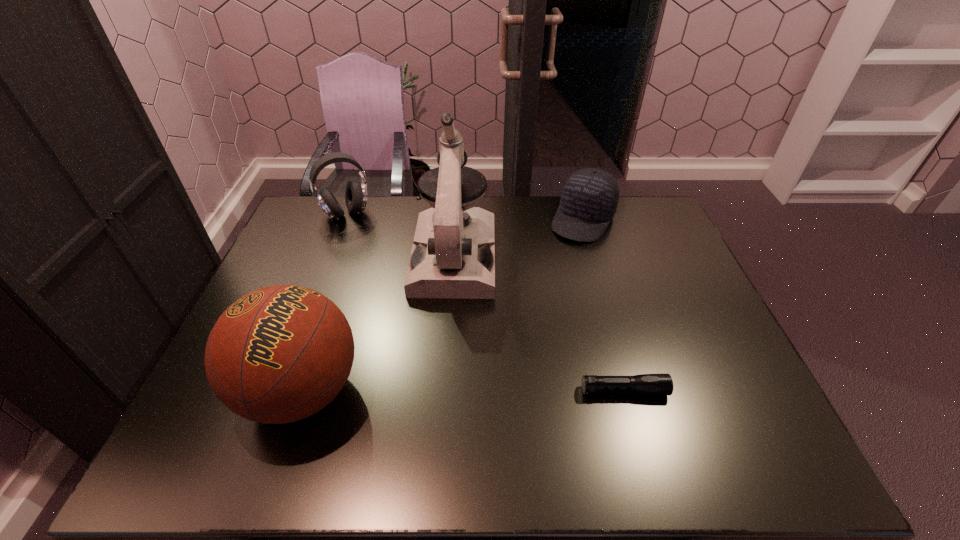
Locate an element on the screen. vacant space situated 0.130m at the eyepiece of the tallest object is located at coordinates (447, 334).

You are a GUI agent. You are given a task and a screenshot of the screen. Output one action in this format:
    pyautogui.click(x=<x>, y=<y>)
    Task: Click on the vacant space located 0.100m on the ear cups of the headset
    
    Given the screenshot: What is the action you would take?
    pyautogui.click(x=359, y=241)

In order to click on free space located 0.350m on the ear cups of the headset in this screenshot , I will do `click(379, 290)`.

The image size is (960, 540). Identify the location of vacant space positioned on the ear cups of the headset. coord(365,255).

The image size is (960, 540). I want to click on free space located at the front of the fourth tallest object where the brim is located, so click(565, 253).

The image size is (960, 540). I want to click on free location located at the front of the fourth tallest object where the brim is located, so click(x=556, y=268).

You are a GUI agent. You are given a task and a screenshot of the screen. Output one action in this format:
    pyautogui.click(x=<x>, y=<y>)
    Task: Click on the free region located 0.200m at the front of the fourth tallest object where the brim is located
    
    Given the screenshot: What is the action you would take?
    pyautogui.click(x=550, y=278)

Locate an element on the screen. This screenshot has width=960, height=540. microscope that is at the far edge is located at coordinates (453, 255).

Where is `headset that is positioned at the far edge`? headset that is positioned at the far edge is located at coordinates (356, 193).

You are a GUI agent. You are given a task and a screenshot of the screen. Output one action in this format:
    pyautogui.click(x=<x>, y=<y>)
    Task: Click on the baseball cap that is positioned at the far edge
    
    Given the screenshot: What is the action you would take?
    pyautogui.click(x=589, y=199)